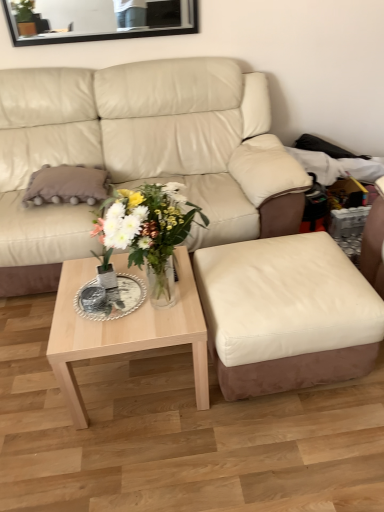
Question: Is light wood/texture coffee table at center bigger or smaller than beige leather couch at center?

Choices:
 (A) small
 (B) big

Answer: (A)

Question: Is light wood/texture coffee table at center taller or shorter than beige leather couch at center?

Choices:
 (A) short
 (B) tall

Answer: (A)

Question: Which is farther from the beige leather couch at center?

Choices:
 (A) clear glass vase at center
 (B) black glass mirror at upper center
 (C) gray fluffy pillow at left
 (D) leather ottoman at center
 (E) light wood/texture coffee table at center

Answer: (A)

Question: Which object is positioned closest to the leather ottoman at center?

Choices:
 (A) beige leather couch at center
 (B) gray fluffy pillow at left
 (C) light wood/texture coffee table at center
 (D) black glass mirror at upper center
 (E) clear glass vase at center

Answer: (C)